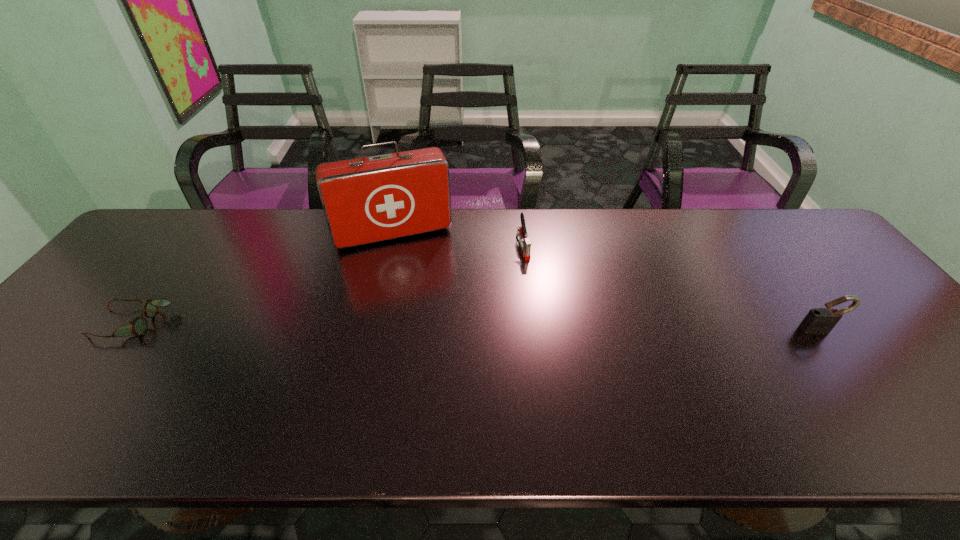
The width and height of the screenshot is (960, 540). In order to click on free space located 0.200m with the keyhole on the front of the padlock in this screenshot , I will do `click(876, 407)`.

Identify the location of vacant space located 0.350m on the handle side of the second shortest object. The width and height of the screenshot is (960, 540). (562, 356).

Find the location of a particular element. free spot located 0.050m on the handle side of the second shortest object is located at coordinates (530, 272).

Find the location of a particular element. The width and height of the screenshot is (960, 540). free space located on the handle side of the second shortest object is located at coordinates (565, 367).

What are the coordinates of `free point located on the side of the tallest object with the first aid cross symbol` in the screenshot? It's located at (412, 265).

Where is `vacant space located 0.360m on the side of the tallest object with the first aid cross symbol`? vacant space located 0.360m on the side of the tallest object with the first aid cross symbol is located at coordinates (438, 343).

Find the location of `vacant space situated on the side of the tallest object with the first aid cross symbol`. vacant space situated on the side of the tallest object with the first aid cross symbol is located at coordinates (442, 356).

At what (x,y) coordinates should I click in order to perform the action: click on stapler that is at the far edge. Please return your answer as a coordinate pair (x, y). Looking at the image, I should click on (525, 243).

The image size is (960, 540). What are the coordinates of `the first-aid kit that is positioned at the far edge` in the screenshot? It's located at point(365,200).

Where is `object present at the left edge`? This screenshot has width=960, height=540. object present at the left edge is located at coordinates (138, 326).